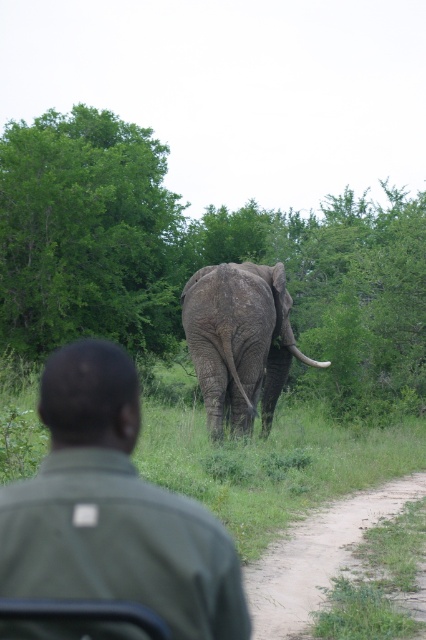
Question: Is green leafy tree at upper left below dirt/grass at lower right?

Choices:
 (A) no
 (B) yes

Answer: (A)

Question: Which object is closer to the camera taking this photo?

Choices:
 (A) green leafy tree at upper left
 (B) green matte shirt at center
 (C) dirt/grass at lower right

Answer: (B)

Question: Which point is farther to the camera?

Choices:
 (A) (311, 362)
 (B) (293, 568)

Answer: (A)

Question: Among these points, which one is farthest from the camera?

Choices:
 (A) (417, 600)
 (B) (425, 355)
 (C) (310, 364)
 (D) (140, 540)

Answer: (B)

Question: Does green leafy tree at center appear on the left side of green matte shirt at center?

Choices:
 (A) yes
 (B) no

Answer: (B)

Question: Is green matte shirt at center to the left of green leafy tree at upper left from the viewer's perspective?

Choices:
 (A) yes
 (B) no

Answer: (B)